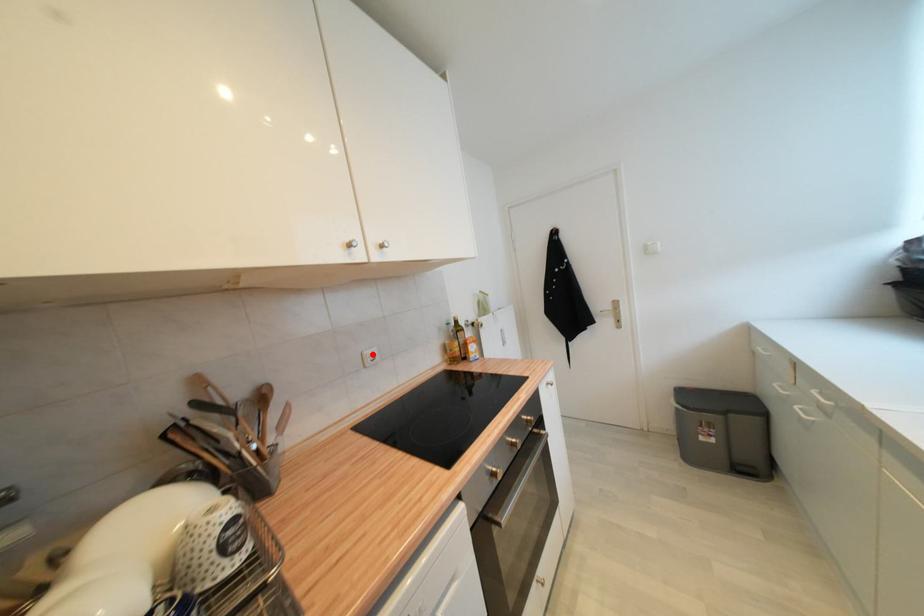
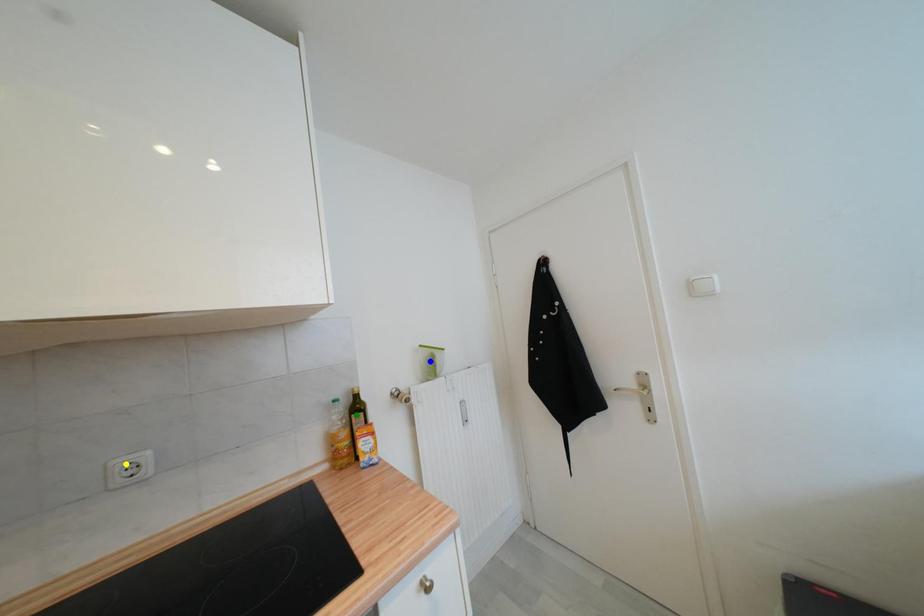
Question: I am providing you with two images of the same scene from different viewpoints. A red point is marked on the first image. You are given multiple points on the second image. Which point in image 2 is actually the same real-world point as the red point in image 1?

Choices:
 (A) yellow point
 (B) green point
 (C) blue point

Answer: (A)